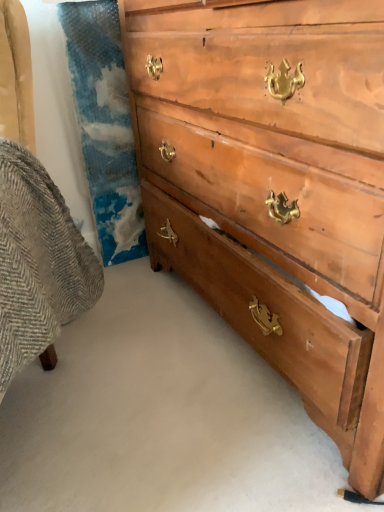
Question: From the image's perspective, does light brown wood chest of drawers at center appear lower than textured gray fabric swivel chair at left?

Choices:
 (A) no
 (B) yes

Answer: (A)

Question: From a real-world perspective, is light brown wood chest of drawers at center on top of textured gray fabric swivel chair at left?

Choices:
 (A) no
 (B) yes

Answer: (B)

Question: Is light brown wood chest of drawers at center further to camera compared to textured gray fabric swivel chair at left?

Choices:
 (A) no
 (B) yes

Answer: (B)

Question: Is the depth of light brown wood chest of drawers at center less than that of textured gray fabric swivel chair at left?

Choices:
 (A) no
 (B) yes

Answer: (A)

Question: Could you tell me if light brown wood chest of drawers at center is turned towards textured gray fabric swivel chair at left?

Choices:
 (A) no
 (B) yes

Answer: (B)

Question: From the image's perspective, would you say light brown wood chest of drawers at center is positioned over textured gray fabric swivel chair at left?

Choices:
 (A) yes
 (B) no

Answer: (A)

Question: Is textured gray fabric swivel chair at left turned away from light brown wood chest of drawers at center?

Choices:
 (A) yes
 (B) no

Answer: (B)

Question: From the image's perspective, does textured gray fabric swivel chair at left appear higher than light brown wood chest of drawers at center?

Choices:
 (A) yes
 (B) no

Answer: (B)

Question: Could you tell me if textured gray fabric swivel chair at left is turned towards light brown wood chest of drawers at center?

Choices:
 (A) no
 (B) yes

Answer: (A)

Question: Is textured gray fabric swivel chair at left positioned in front of light brown wood chest of drawers at center?

Choices:
 (A) no
 (B) yes

Answer: (B)

Question: Is textured gray fabric swivel chair at left bigger than light brown wood chest of drawers at center?

Choices:
 (A) yes
 (B) no

Answer: (B)

Question: Is textured gray fabric swivel chair at left not inside light brown wood chest of drawers at center?

Choices:
 (A) no
 (B) yes

Answer: (B)

Question: In terms of width, does light brown wood chest of drawers at center look wider or thinner when compared to textured gray fabric swivel chair at left?

Choices:
 (A) wide
 (B) thin

Answer: (B)